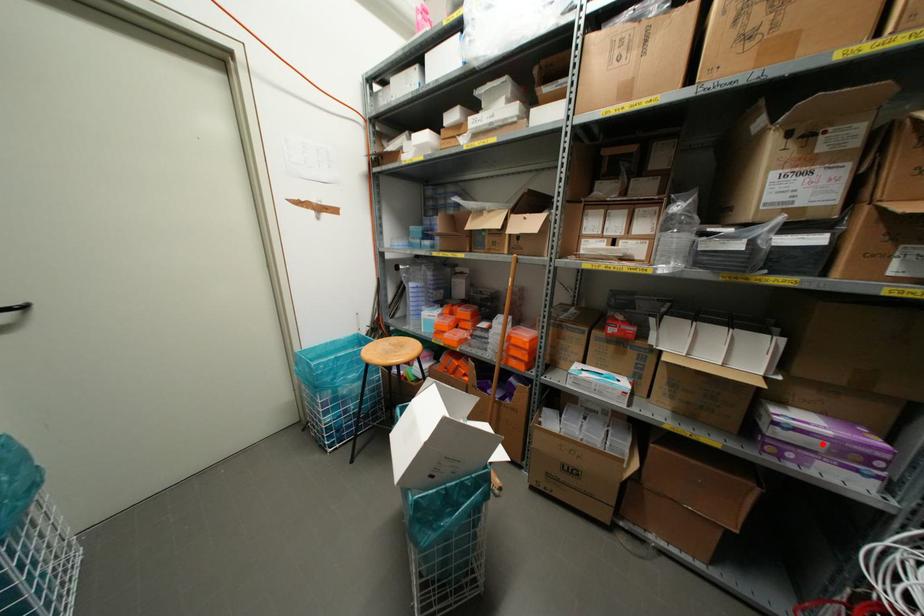
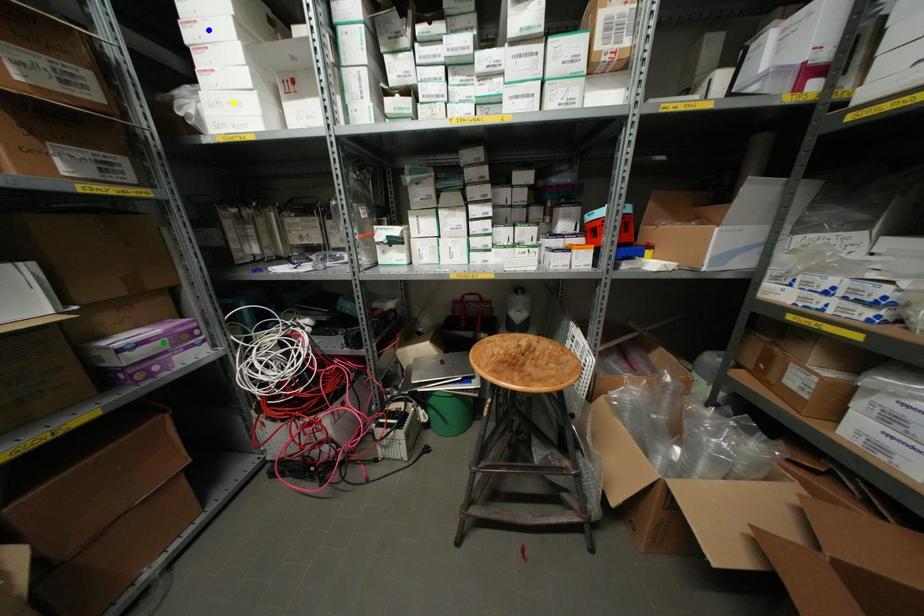
Question: I am providing you with two images of the same scene from different viewpoints. A red point is marked on the first image. You are given multiple points on the second image. Can you choose the point in image 2 that corresponds to the point in image 1?

Choices:
 (A) yellow point
 (B) green point
 (C) blue point

Answer: (B)